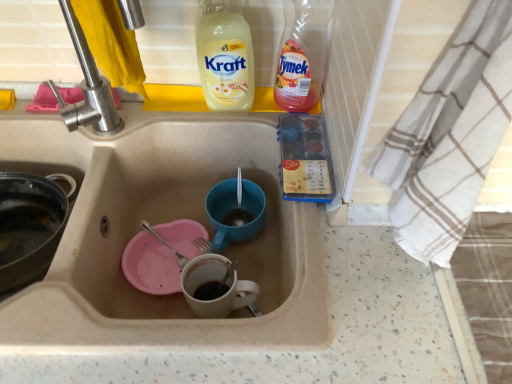
Where is `satin nickel faucet at upper left`? The image size is (512, 384). satin nickel faucet at upper left is located at coordinates (89, 87).

Where is `translucent plastic bottle at upper right`? This screenshot has height=384, width=512. translucent plastic bottle at upper right is located at coordinates (302, 54).

What do you see at coordinates (162, 221) in the screenshot?
I see `beige ceramic sink at center` at bounding box center [162, 221].

In order to face beige ceramic sink at center, should I rotate leftwards or rightwards?

It's best to rotate left around 18.460 degrees.

This screenshot has width=512, height=384. What do you see at coordinates (450, 135) in the screenshot? I see `white cotton towel at right` at bounding box center [450, 135].

This screenshot has height=384, width=512. Find the location of `satin nickel faucet at upper left`. satin nickel faucet at upper left is located at coordinates (89, 87).

The height and width of the screenshot is (384, 512). I want to click on bottle that appears above the yellow liquid soap at upper center (from a real-world perspective), so click(302, 54).

Are translucent plastic bottle at upper right and yellow liquid soap at upper center far apart?

→ That's not correct — translucent plastic bottle at upper right is a little close to yellow liquid soap at upper center.

Which of these two, translucent plastic bottle at upper right or yellow liquid soap at upper center, stands shorter?

With less height is yellow liquid soap at upper center.

Does yellow liquid soap at upper center turn towards blue matte cup at center?

No.

From a real-world perspective, is yellow liquid soap at upper center over blue matte cup at center?

Indeed, from a real-world perspective, yellow liquid soap at upper center stands above blue matte cup at center.

In the image, is yellow liquid soap at upper center positioned in front of or behind blue matte cup at center?

In the image, yellow liquid soap at upper center appears in front of blue matte cup at center.

Is yellow liquid soap at upper center not inside blue matte cup at center?

Indeed, yellow liquid soap at upper center is completely outside blue matte cup at center.

Is there a large distance between white cotton towel at right and translucent plastic bottle at upper right?

No, white cotton towel at right is not far from translucent plastic bottle at upper right.

How far apart are white cotton towel at right and translucent plastic bottle at upper right?

They are 13.06 inches apart.

Does white cotton towel at right appear on the left side of translucent plastic bottle at upper right?

Incorrect, white cotton towel at right is not on the left side of translucent plastic bottle at upper right.

Is white cotton towel at right oriented towards translucent plastic bottle at upper right?

No, white cotton towel at right is not facing towards translucent plastic bottle at upper right.

Measure the distance between translucent plastic bottle at upper right and satin nickel faucet at upper left.

translucent plastic bottle at upper right and satin nickel faucet at upper left are 13.60 inches apart.

Does point (300, 75) appear closer or farther from the camera than point (79, 105)?

Point (300, 75) appears to be closer to the viewer than point (79, 105).

What's the angular difference between translucent plastic bottle at upper right and satin nickel faucet at upper left's facing directions?

22.7 degrees separate the facing orientations of translucent plastic bottle at upper right and satin nickel faucet at upper left.

Between translucent plastic bottle at upper right and satin nickel faucet at upper left, which one is positioned behind?

translucent plastic bottle at upper right is further from the camera.

Is satin nickel faucet at upper left positioned behind blue matte cup at center?

No, it is in front of blue matte cup at center.

Looking at this image, is satin nickel faucet at upper left outside of blue matte cup at center?

satin nickel faucet at upper left lies outside blue matte cup at center's area.

Is satin nickel faucet at upper left positioned with its back to blue matte cup at center?

satin nickel faucet at upper left does not have its back to blue matte cup at center.

Which is nearer, (76, 115) or (253, 204)?

Point (76, 115).

How much distance is there between blue matte cup at center and satin nickel faucet at upper left?

blue matte cup at center is 10.92 inches from satin nickel faucet at upper left.

In the image, is blue matte cup at center positioned in front of or behind satin nickel faucet at upper left?

In the image, blue matte cup at center appears behind satin nickel faucet at upper left.

Is blue matte cup at center to the left or to the right of satin nickel faucet at upper left in the image?

In the image, blue matte cup at center appears on the right side of satin nickel faucet at upper left.

Based on their positions, is beige ceramic sink at center located to the left or right of blue matte cup at center?

Based on their positions, beige ceramic sink at center is located to the left of blue matte cup at center.

Would you consider beige ceramic sink at center to be distant from blue matte cup at center?

No, beige ceramic sink at center is not far away from blue matte cup at center.

Considering the sizes of objects beige ceramic sink at center and blue matte cup at center in the image provided, who is bigger, beige ceramic sink at center or blue matte cup at center?

Bigger between the two is beige ceramic sink at center.

Is beige ceramic sink at center oriented towards blue matte cup at center?

No, beige ceramic sink at center is not aimed at blue matte cup at center.

This screenshot has width=512, height=384. I want to click on drink that appears on the left of translucent plastic bottle at upper right, so click(225, 56).

Identify the location of basin lying on the right of yellow liquid soap at upper center. The height and width of the screenshot is (384, 512). (233, 209).

Considering their positions, is white cotton towel at right positioned further to yellow liquid soap at upper center than blue matte cup at center?

white cotton towel at right.

Which object lies further to the anchor point white cotton towel at right, blue matte cup at center or yellow liquid soap at upper center?

yellow liquid soap at upper center lies further to white cotton towel at right than the other object.

Considering their positions, is blue matte cup at center positioned further to beige ceramic sink at center than yellow liquid soap at upper center?

yellow liquid soap at upper center.

When comparing their distances from beige ceramic sink at center, does yellow liquid soap at upper center or satin nickel faucet at upper left seem further?

yellow liquid soap at upper center.

When comparing their distances from translucent plastic bottle at upper right, does yellow liquid soap at upper center or beige ceramic sink at center seem closer?

Based on the image, yellow liquid soap at upper center appears to be nearer to translucent plastic bottle at upper right.

When comparing their distances from yellow liquid soap at upper center, does white cotton towel at right or satin nickel faucet at upper left seem further?

Among the two, white cotton towel at right is located further to yellow liquid soap at upper center.

Which object lies further to the anchor point white cotton towel at right, beige ceramic sink at center or yellow liquid soap at upper center?

yellow liquid soap at upper center.

When comparing their distances from satin nickel faucet at upper left, does white cotton towel at right or translucent plastic bottle at upper right seem further?

white cotton towel at right is further to satin nickel faucet at upper left.

Identify the location of drink between satin nickel faucet at upper left and white cotton towel at right. (225, 56).

At what (x,y) coordinates should I click in order to perform the action: click on bottle between white cotton towel at right and yellow liquid soap at upper center from front to back. Please return your answer as a coordinate pair (x, y). Image resolution: width=512 pixels, height=384 pixels. Looking at the image, I should click on (302, 54).

Locate an element on the screen. tap between yellow liquid soap at upper center and blue matte cup at center in the vertical direction is located at coordinates (x=89, y=87).

The height and width of the screenshot is (384, 512). I want to click on tap between beige ceramic sink at center and translucent plastic bottle at upper right, so (x=89, y=87).